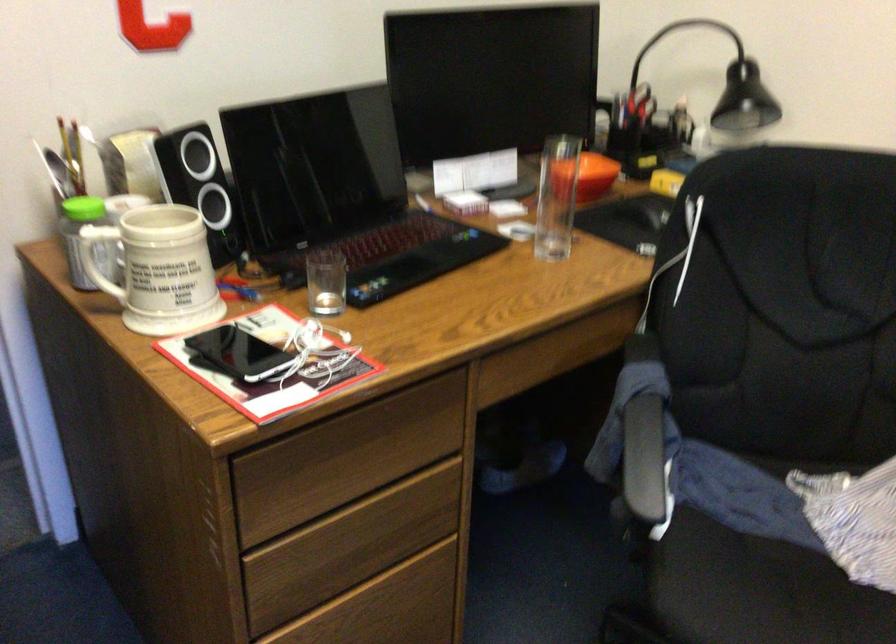
Where would you sit the chair sitting surface? Please return your answer as a coordinate pair (x, y).

(757, 591)